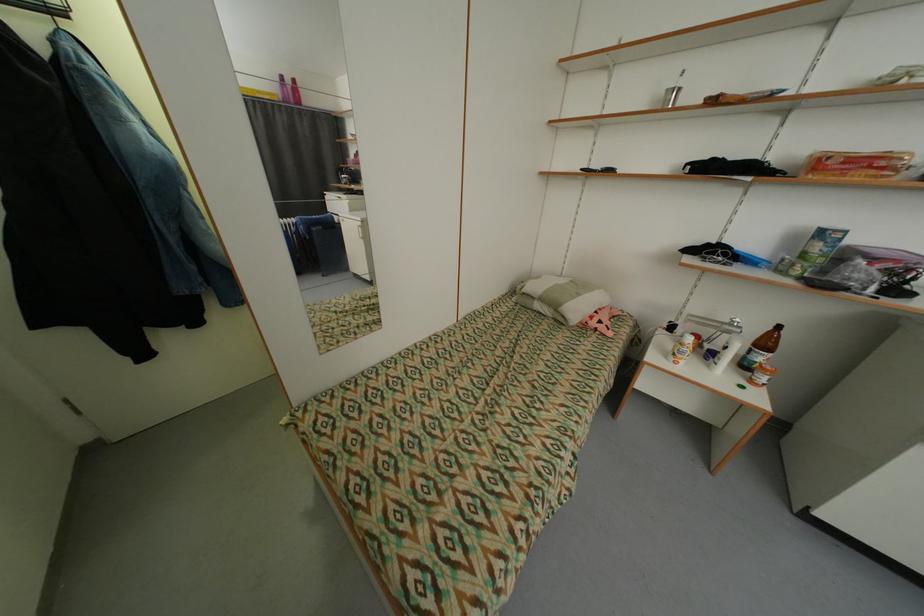
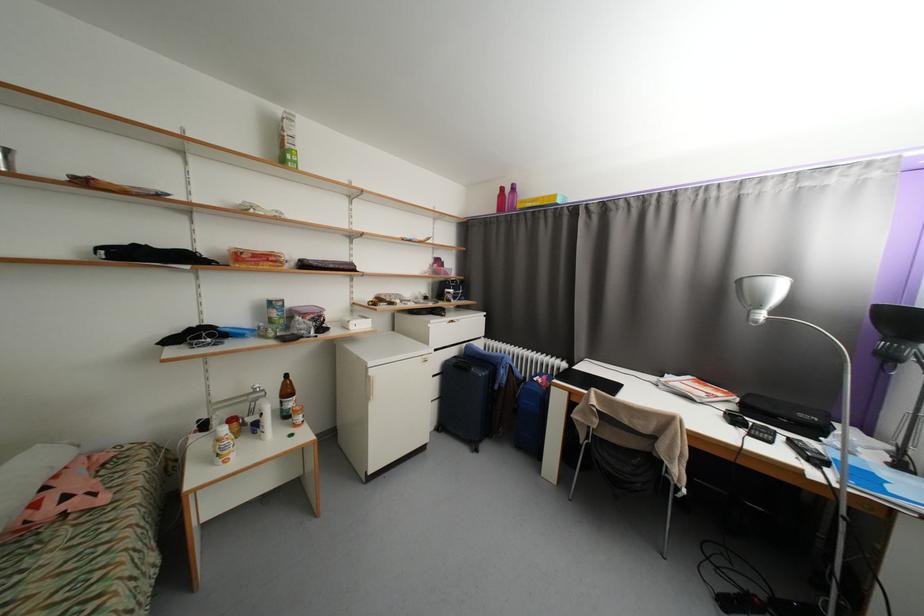
In the second image, find the point that corresponds to [736,326] in the first image.

(261, 392)